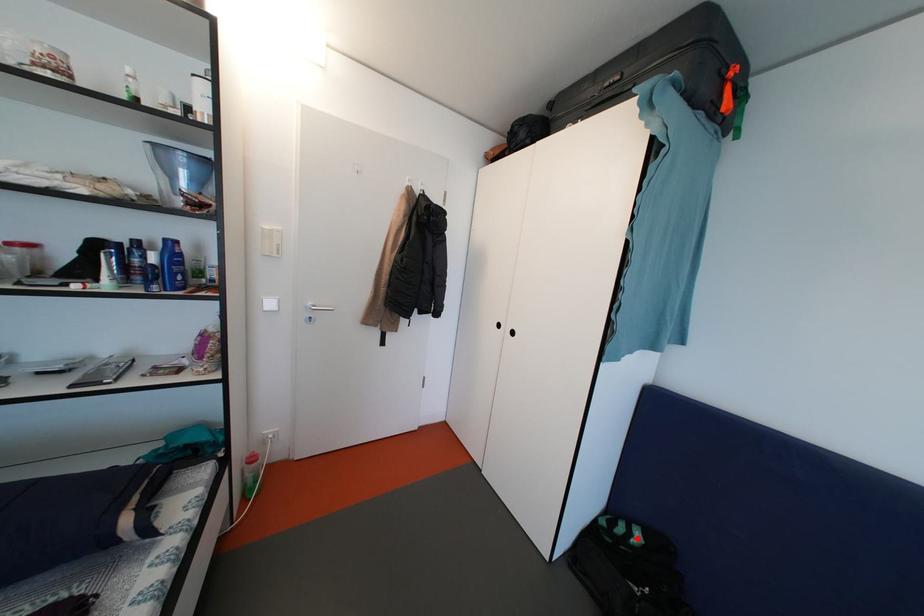
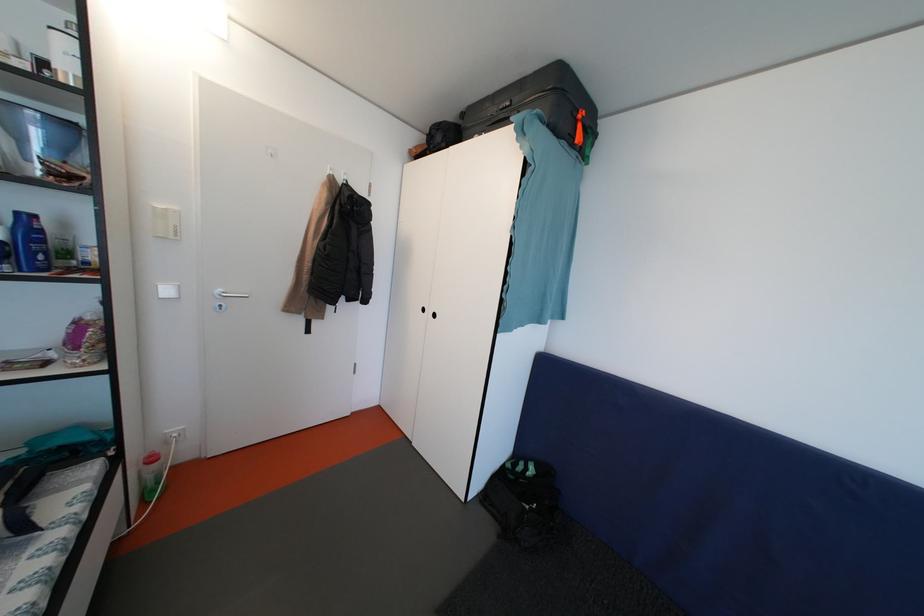
Where in the second image is the point corresponding to the highlighted location from the first image?

(533, 474)